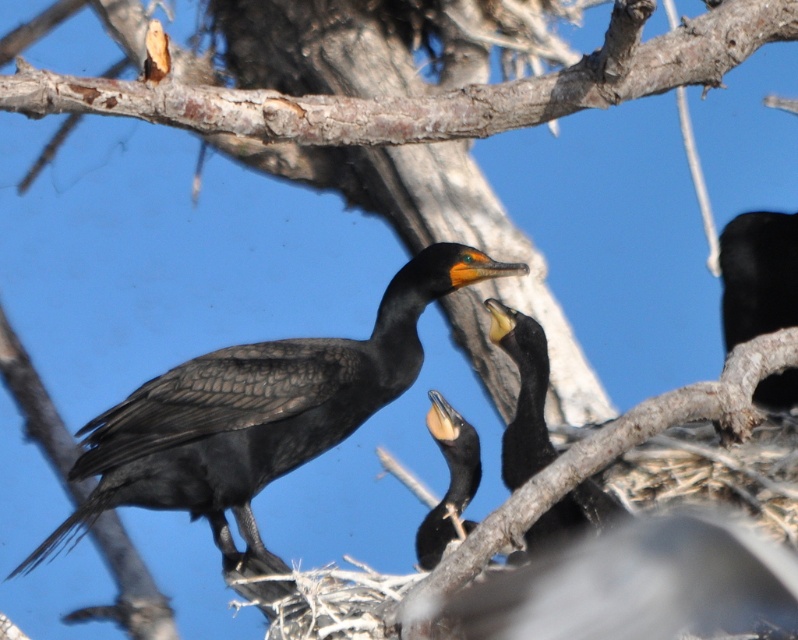
Can you confirm if smooth bark branch at upper center is bigger than shiny black cormorant at center?

Indeed, smooth bark branch at upper center has a larger size compared to shiny black cormorant at center.

Does smooth bark branch at upper center have a lesser width compared to shiny black cormorant at center?

No.

Is point (607, 60) farther from camera compared to point (439, 396)?

No.

Find the location of `smooth bark branch at upper center`. smooth bark branch at upper center is located at coordinates (433, 93).

Can you confirm if smooth bark branch at upper center is positioned to the right of black matte bird at center?

In fact, smooth bark branch at upper center is to the left of black matte bird at center.

Between point (617, 1) and point (532, 413), which one is positioned in front?

Point (617, 1) is in front.

At what (x,y) coordinates should I click in order to perform the action: click on smooth bark branch at upper center. Please return your answer as a coordinate pair (x, y). Looking at the image, I should click on (433, 93).

From the picture: Between matte black bird at center and black matte bird at center, which one appears on the left side from the viewer's perspective?

From the viewer's perspective, matte black bird at center appears more on the left side.

Can you confirm if matte black bird at center is bigger than black matte bird at center?

Yes, matte black bird at center is bigger than black matte bird at center.

This screenshot has width=798, height=640. What are the coordinates of `matte black bird at center` in the screenshot? It's located at pyautogui.click(x=257, y=412).